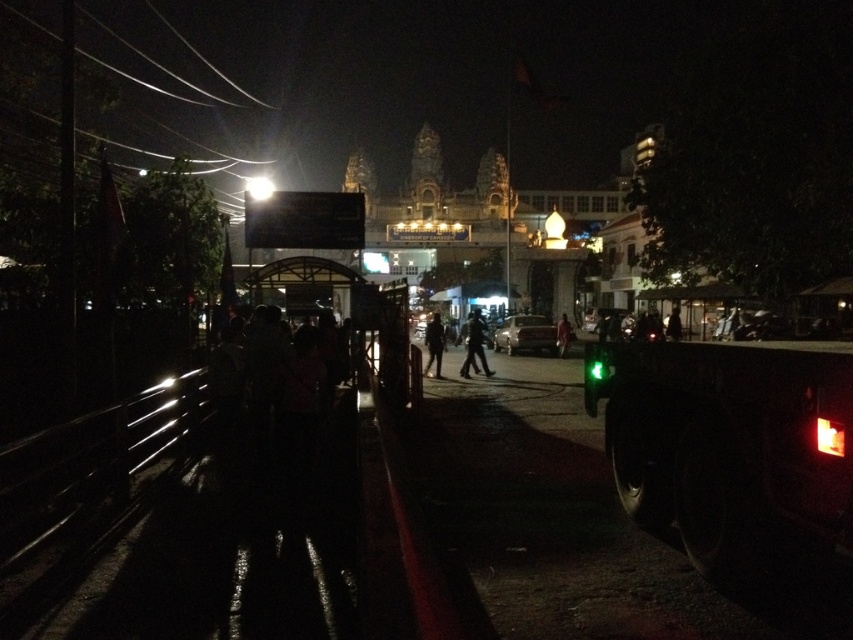
You are a GUI agent. You are given a task and a screenshot of the screen. Output one action in this format:
    pyautogui.click(x=<x>, y=<y>)
    Task: Click on the dark fabric person at center
    The width and height of the screenshot is (853, 640).
    Given the screenshot: What is the action you would take?
    pyautogui.click(x=434, y=342)

Is dark fabric person at center positioned in front of red fabric person at center?

Yes, dark fabric person at center is closer to the viewer.

Measure the distance between point (440, 321) and camera.

Point (440, 321) and camera are 153.07 meters apart.

Identify the location of dark fabric person at center. Image resolution: width=853 pixels, height=640 pixels. (434, 342).

Which is below, black matte pants at center or dark fabric person at center?

Positioned lower is dark fabric person at center.

Does point (469, 317) come farther from viewer compared to point (431, 362)?

Yes, it is.

The width and height of the screenshot is (853, 640). Find the location of `black matte pants at center`. black matte pants at center is located at coordinates (474, 346).

From the picture: Does black matte pants at center appear under red fabric person at center?

Correct, black matte pants at center is located below red fabric person at center.

Measure the distance between black matte pants at center and red fabric person at center.

The distance of black matte pants at center from red fabric person at center is 73.74 feet.

The height and width of the screenshot is (640, 853). I want to click on black matte pants at center, so click(x=474, y=346).